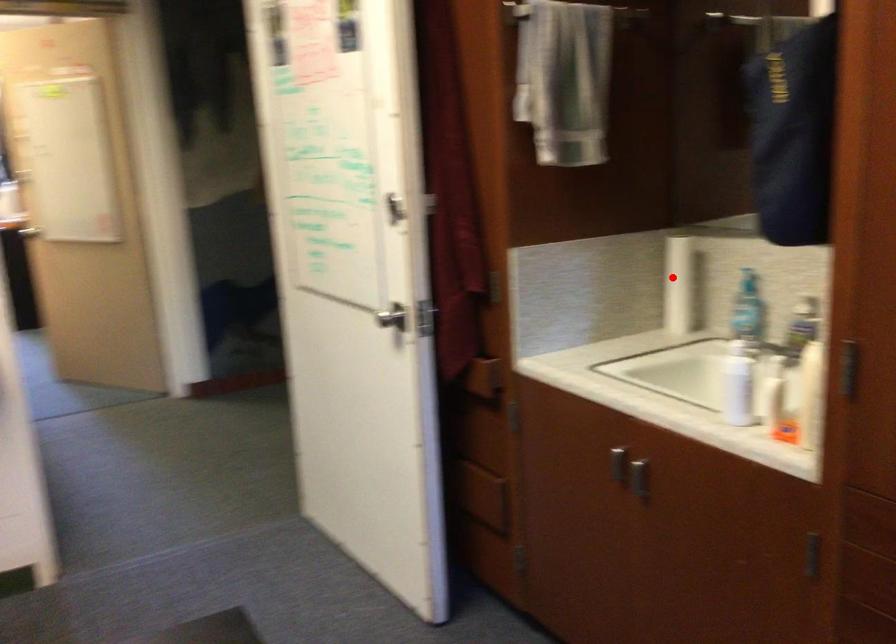
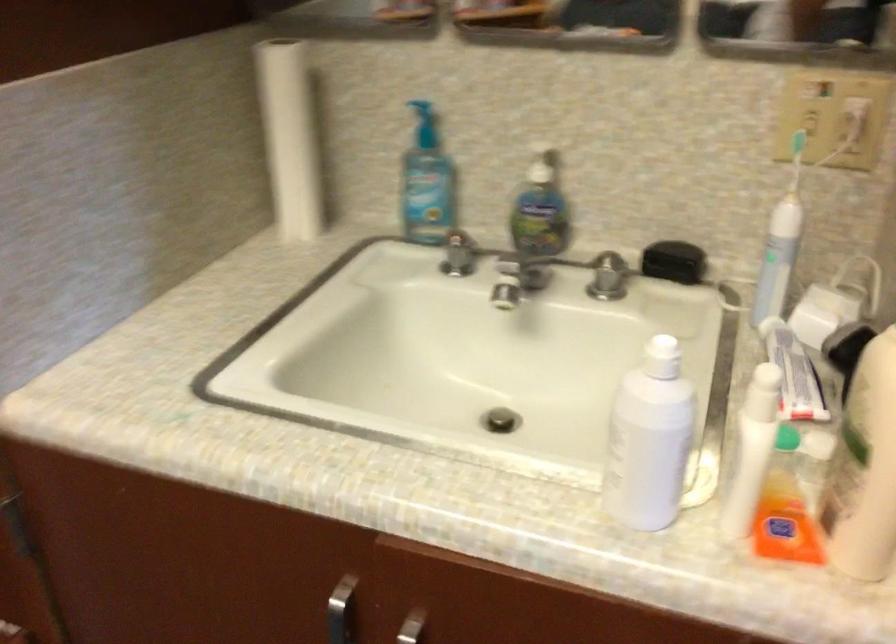
Find the pixel in the second image that matches the highlighted location in the first image.

(289, 138)